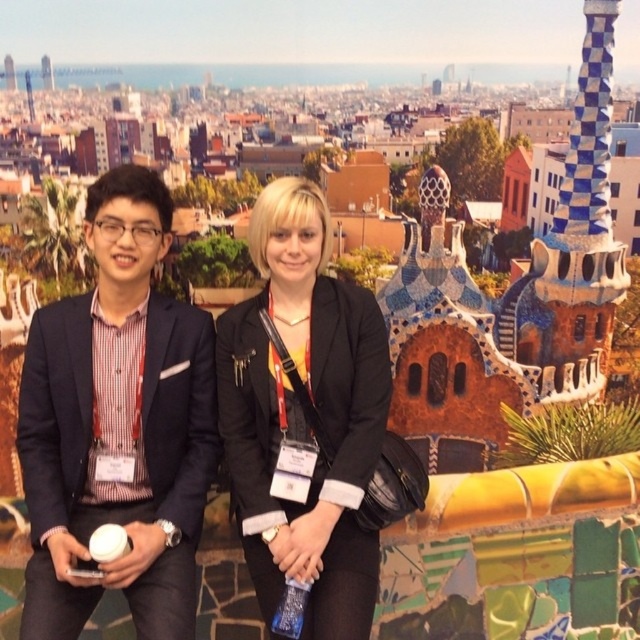
Question: Which of the following is the farthest from the observer?

Choices:
 (A) (364, 588)
 (B) (164, 451)

Answer: (B)

Question: Is matte black blazer at left further to camera compared to black matte jacket at center?

Choices:
 (A) yes
 (B) no

Answer: (B)

Question: Which object is farther from the camera taking this photo?

Choices:
 (A) matte black blazer at left
 (B) black matte jacket at center

Answer: (B)

Question: Which object is farther from the camera taking this photo?

Choices:
 (A) black matte jacket at center
 (B) matte black blazer at left

Answer: (A)

Question: Can you confirm if matte black blazer at left is smaller than black matte jacket at center?

Choices:
 (A) no
 (B) yes

Answer: (B)

Question: Does matte black blazer at left have a greater width compared to black matte jacket at center?

Choices:
 (A) no
 (B) yes

Answer: (B)